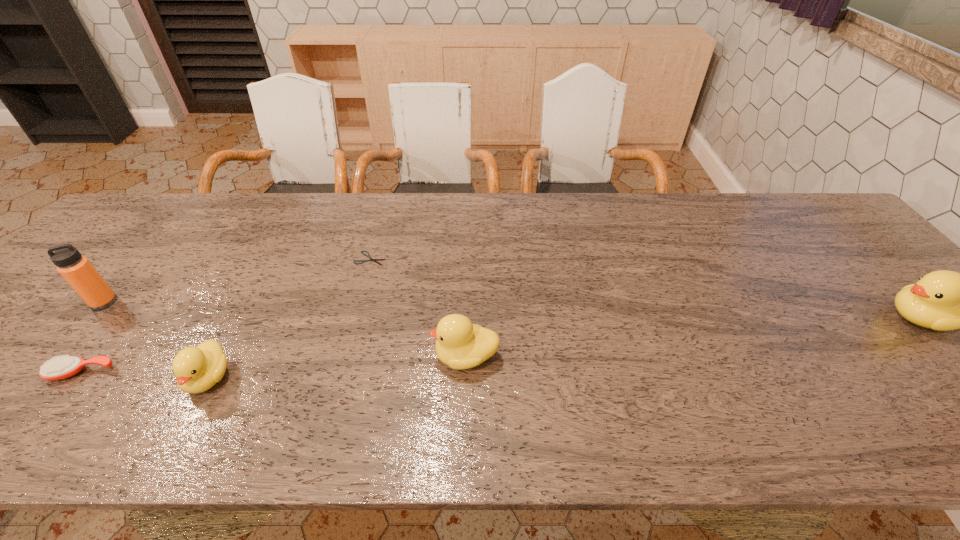
Where is `vacant spot for a new duckling to ensure equal spacing`? The height and width of the screenshot is (540, 960). vacant spot for a new duckling to ensure equal spacing is located at coordinates (703, 337).